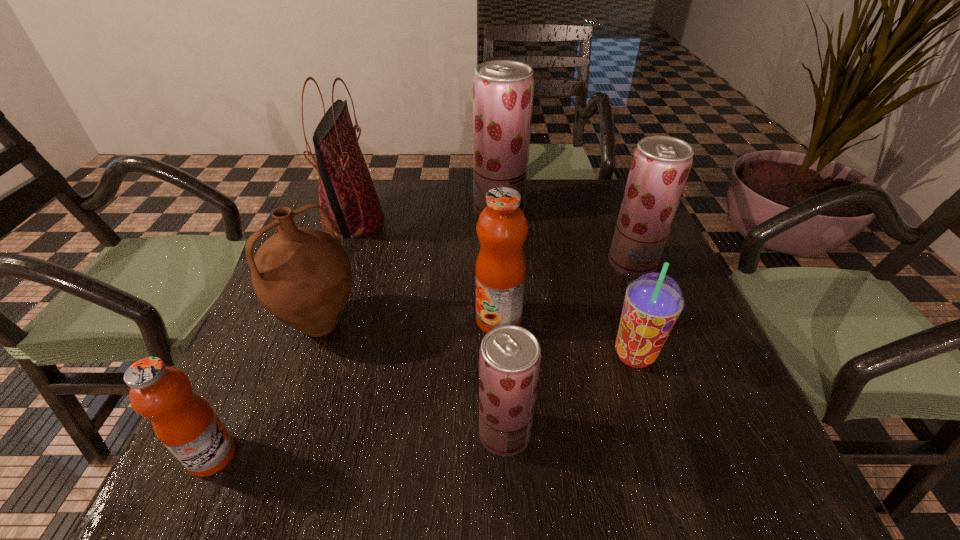
Locate an element on the screen. The image size is (960, 540). vacant region that satisfies the following two spatial constraints: 1. on the front side of the pitcher; 2. on the left side of the smallest strawberry fruit juice is located at coordinates (281, 434).

This screenshot has width=960, height=540. I want to click on vacant space that satisfies the following two spatial constraints: 1. on the front side of the handbag; 2. on the left side of the rightmost strawberry fruit juice, so click(338, 264).